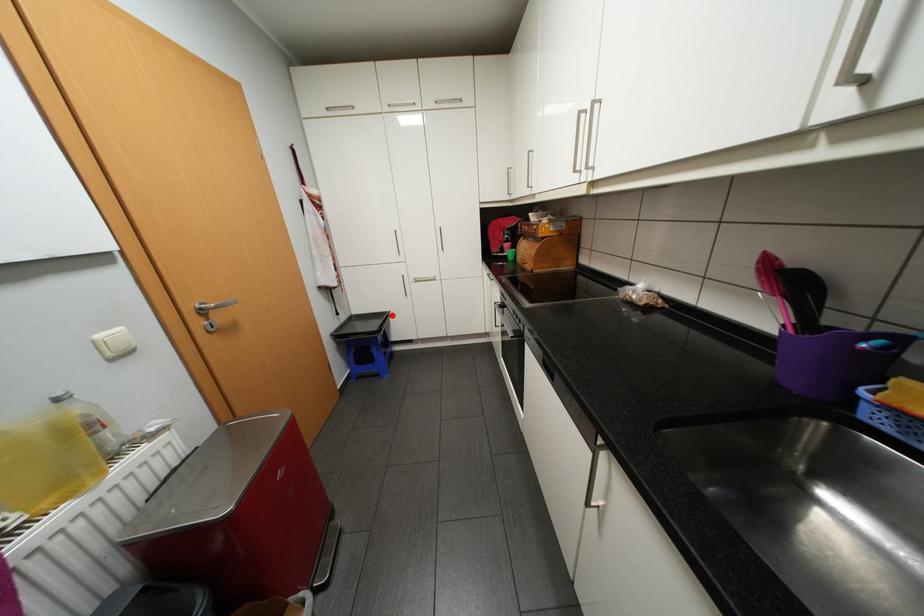
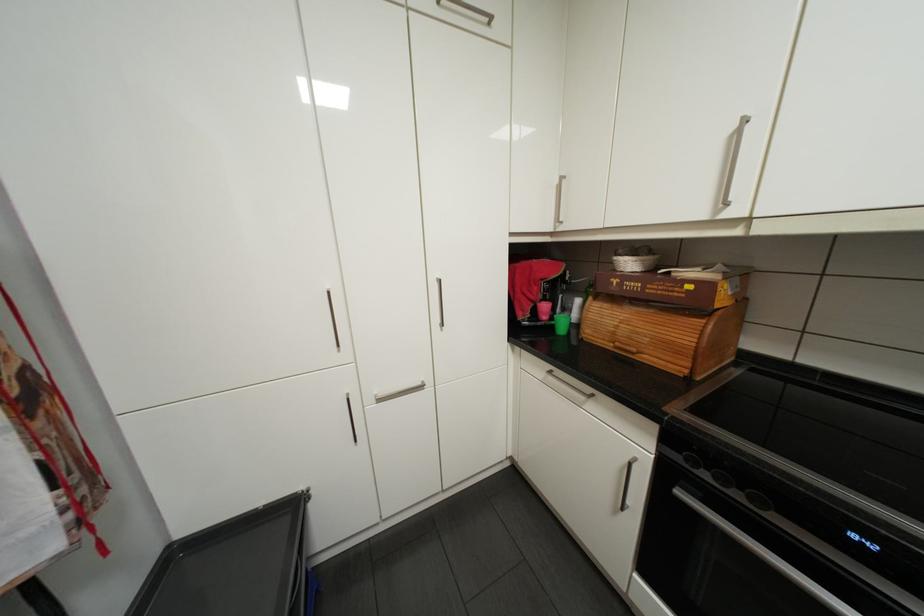
Question: I am providing you with two images of the same scene from different viewpoints. Image1 has a red point marked. In image2, the corresponding 3D location appears at what relative position? Reply with the corresponding letter.

Choices:
 (A) Closer
 (B) Farther

Answer: (B)